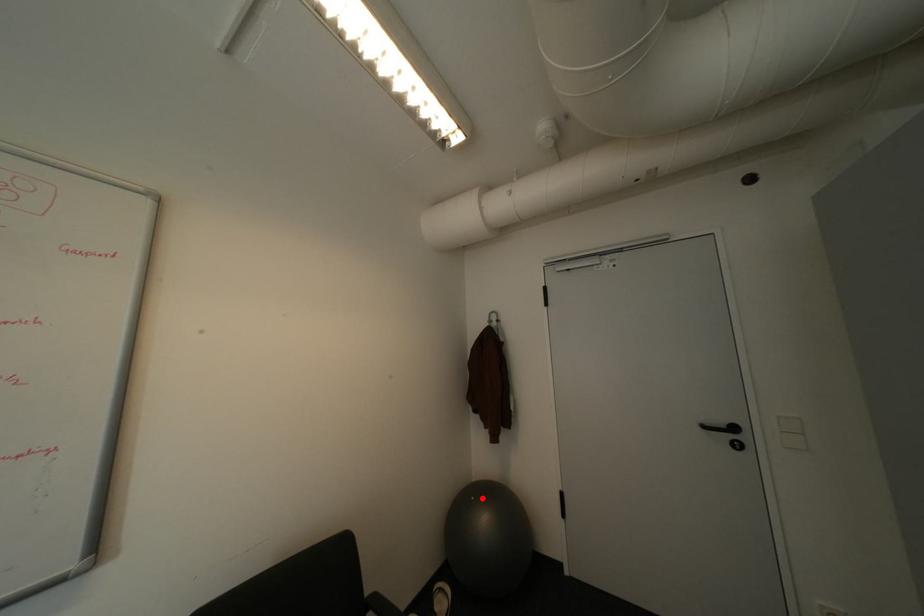
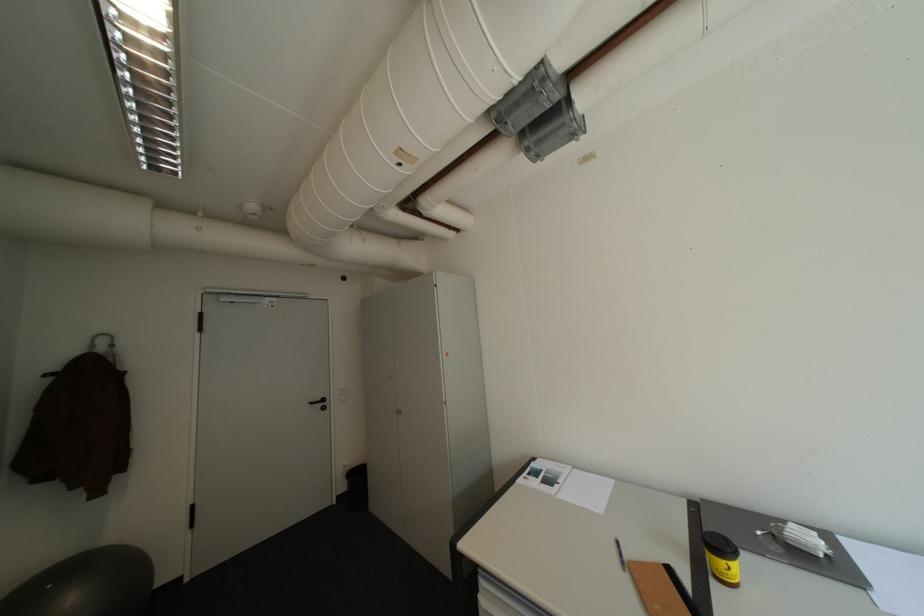
Where in the second image is the point corresponding to the highlighted location from the first image?

(59, 586)